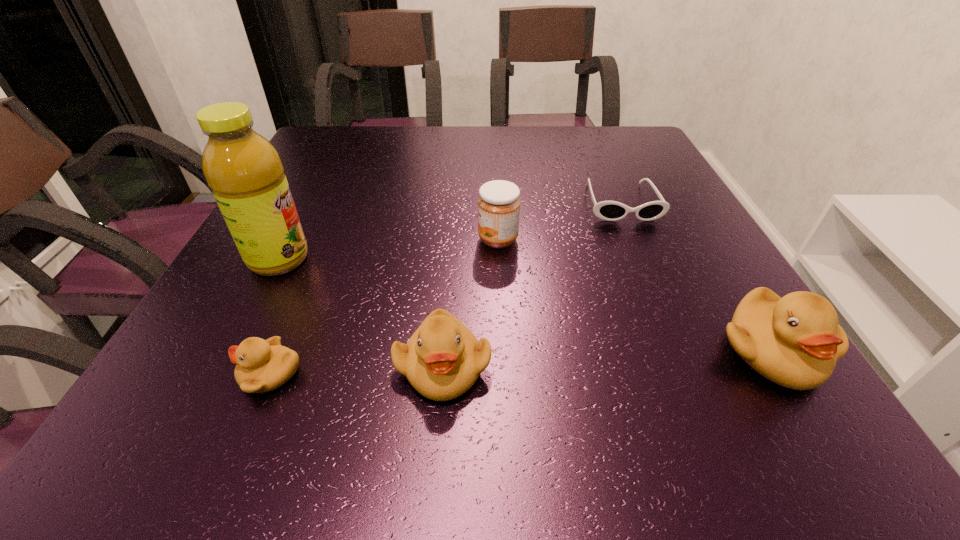
Locate an element on the screen. the third closest duckling to the fruit juice is located at coordinates (795, 341).

Identify which duckling is located as the third nearest to the shortest object. Please provide its 2D coordinates. Your answer should be formatted as a tuple, i.e. [(x, y)], where the tuple contains the x and y coordinates of a point satisfying the conditions above.

[(262, 365)]

Where is `blank space that satisfies the following two spatial constraints: 1. on the front label of the jam; 2. at the beak of the second tallest duckling`? Image resolution: width=960 pixels, height=540 pixels. blank space that satisfies the following two spatial constraints: 1. on the front label of the jam; 2. at the beak of the second tallest duckling is located at coordinates (504, 366).

At what (x,y) coordinates should I click in order to perform the action: click on vacant area in the image that satisfies the following two spatial constraints: 1. with the lenses of the farthest object facing outward; 2. on the front label of the tallest object. Please return your answer as a coordinate pair (x, y). Looking at the image, I should click on (645, 259).

What are the coordinates of `free space that satisfies the following two spatial constraints: 1. with the lenses of the farthest object facing outward; 2. on the front label of the jam` in the screenshot? It's located at (637, 240).